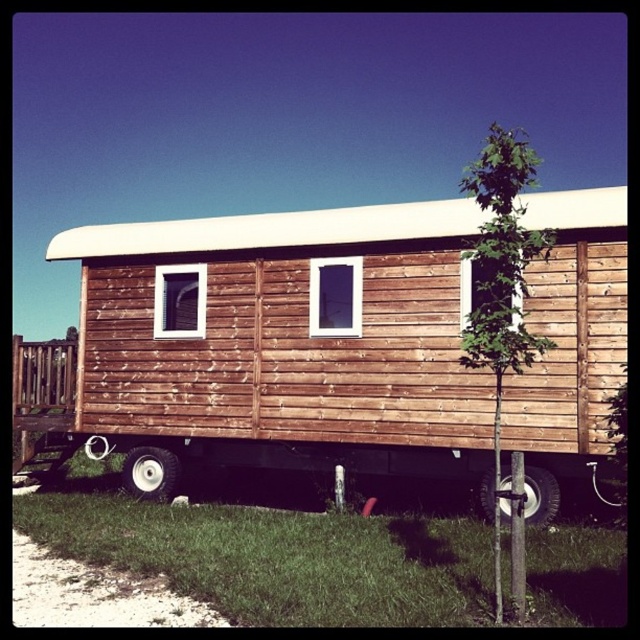
You are standing in front of the wooden trailer and want to place a small potted plant on the brown wooden train car at center. Can you place it there without it falling off onto the black rubber tire at lower center?

The brown wooden train car at center is above the black rubber tire at lower center, so placing the potted plant there should be safe as it won